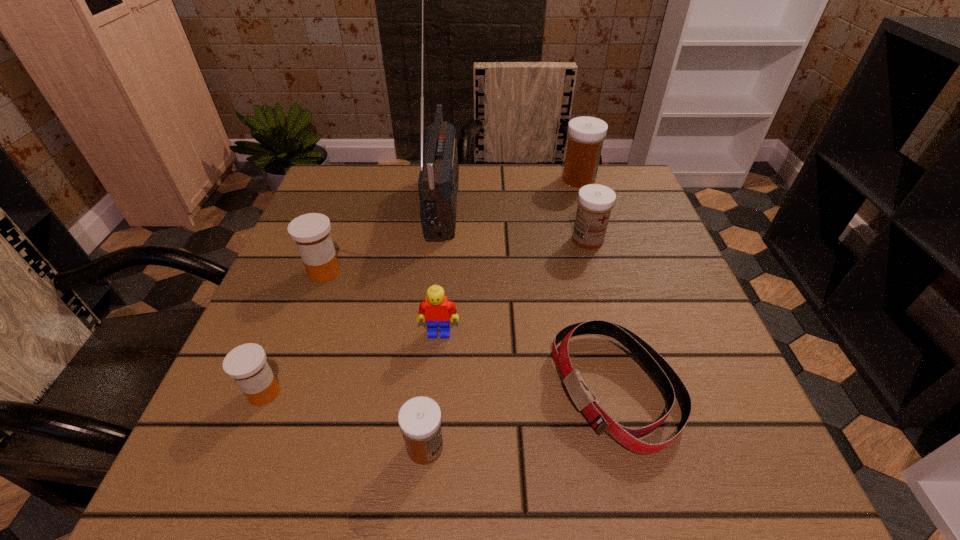
The height and width of the screenshot is (540, 960). Identify the location of vacant space located 0.220m on the right of the leftmost white medicine. (597, 447).

Where is `vacant space situated 0.200m on the left of the dog collar`? The height and width of the screenshot is (540, 960). vacant space situated 0.200m on the left of the dog collar is located at coordinates (430, 389).

Where is `radio receiver that is at the far edge`? This screenshot has height=540, width=960. radio receiver that is at the far edge is located at coordinates (438, 180).

Where is `medicine positioned at the far edge`? medicine positioned at the far edge is located at coordinates (586, 134).

Image resolution: width=960 pixels, height=540 pixels. I want to click on medicine at the near edge, so click(x=419, y=418).

I want to click on dog collar at the near edge, so click(x=670, y=383).

This screenshot has width=960, height=540. In order to click on dog collar situated at the right edge in this screenshot , I will do `click(670, 383)`.

Identify the location of object that is at the far right corner. The image size is (960, 540). (586, 134).

Where is `object present at the near right corner`? The width and height of the screenshot is (960, 540). object present at the near right corner is located at coordinates (670, 383).

Identify the location of free space at the far edge of the desktop. The width and height of the screenshot is (960, 540). (479, 179).